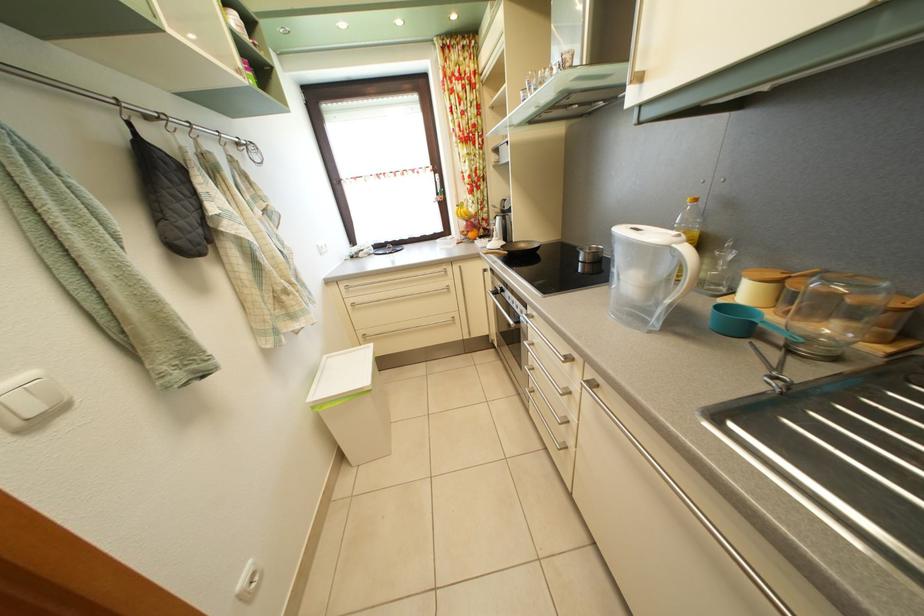
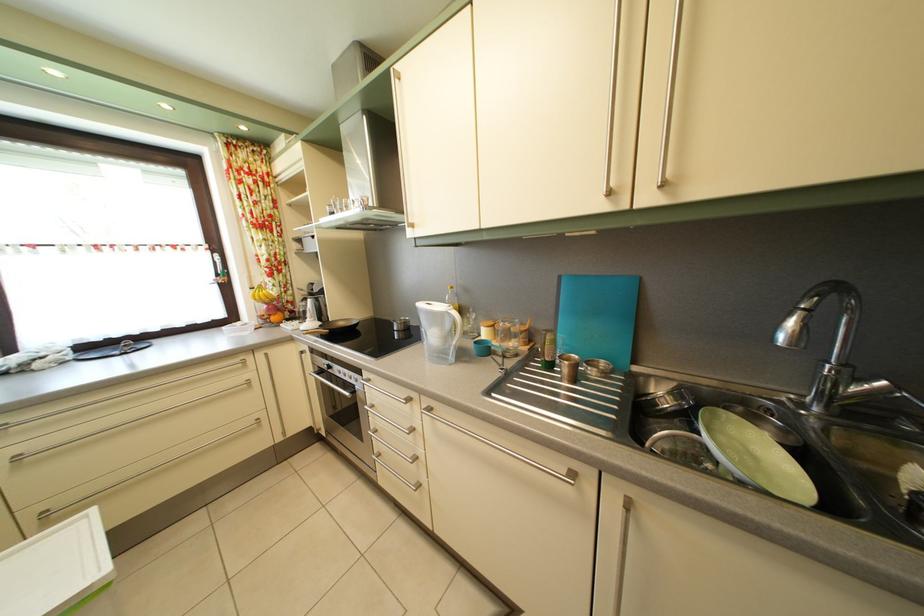
The point at (614,262) is marked in the first image. Where is the corresponding point in the second image?

(420, 331)